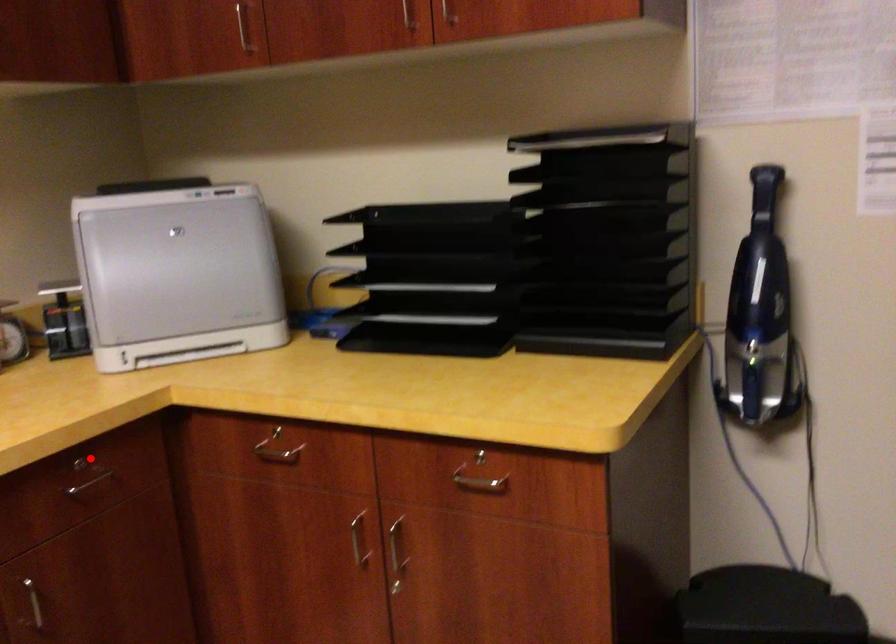
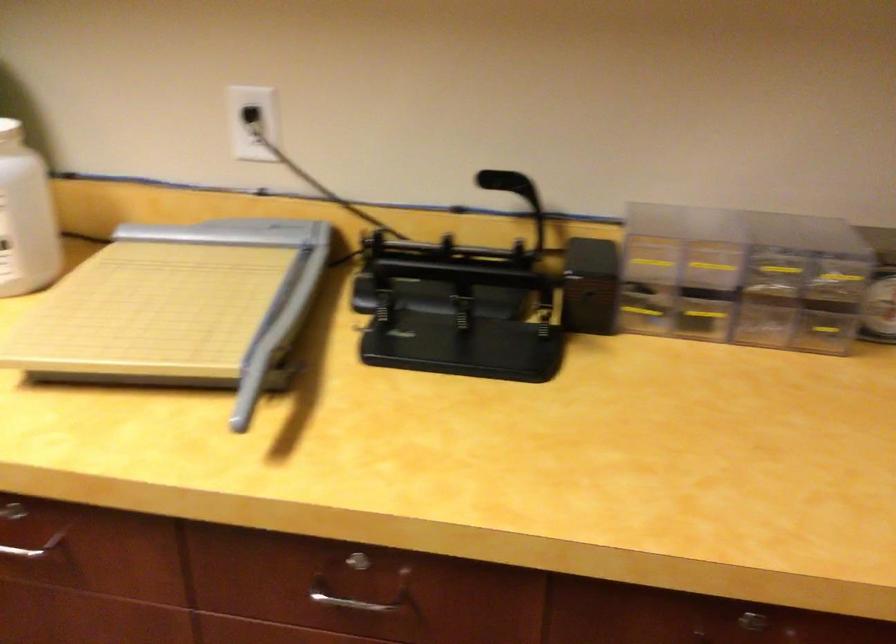
Locate, in the second image, the point that corresponds to the highlighted location in the first image.

(748, 623)